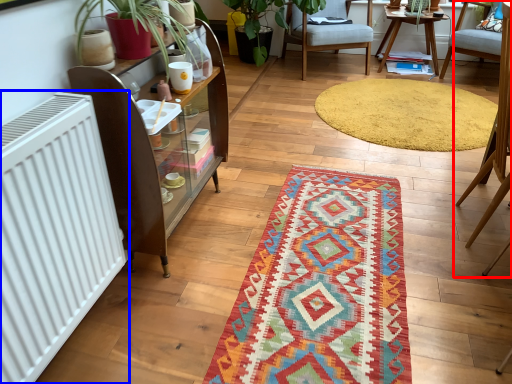
Question: Which object is closer to the camera taking this photo, chair (highlighted by a red box) or radiator (highlighted by a blue box)?

Choices:
 (A) chair
 (B) radiator

Answer: (B)